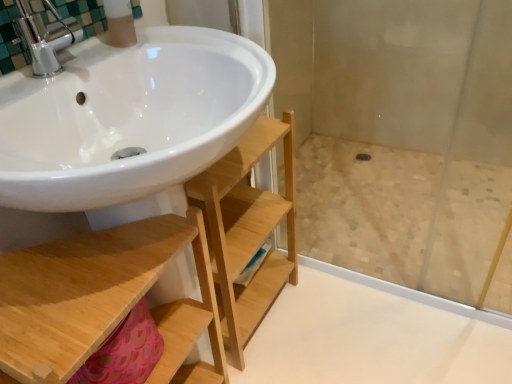
What are the coordinates of `unoccupied area in front of matte plastic soap dispenser at upper left` in the screenshot? It's located at (101, 67).